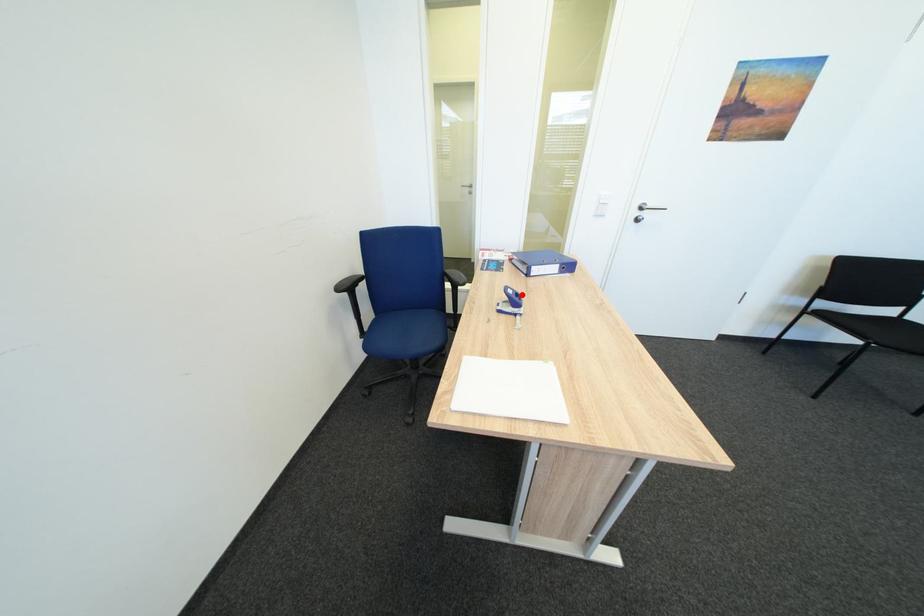
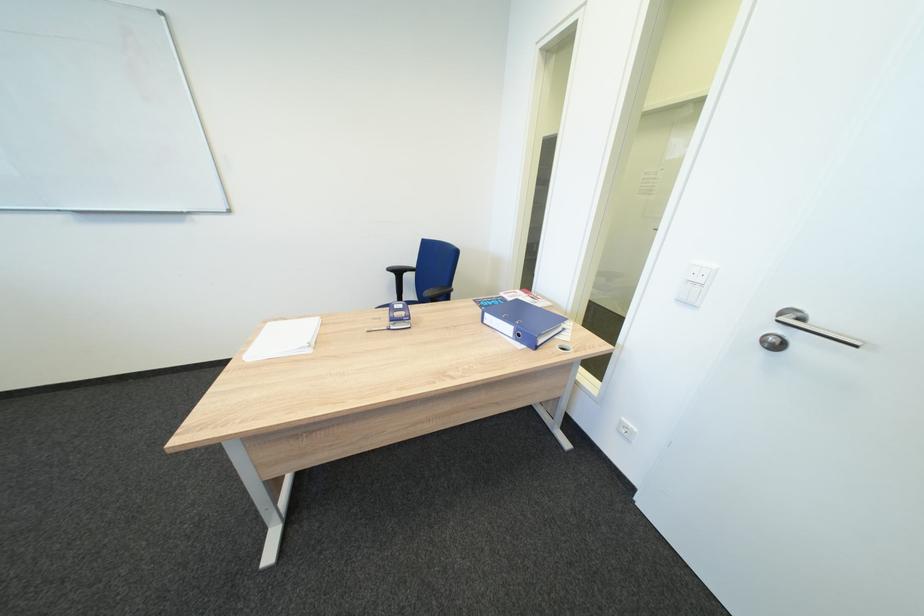
Where in the second image is the point corresponding to the highlighted location from the first image?

(407, 309)